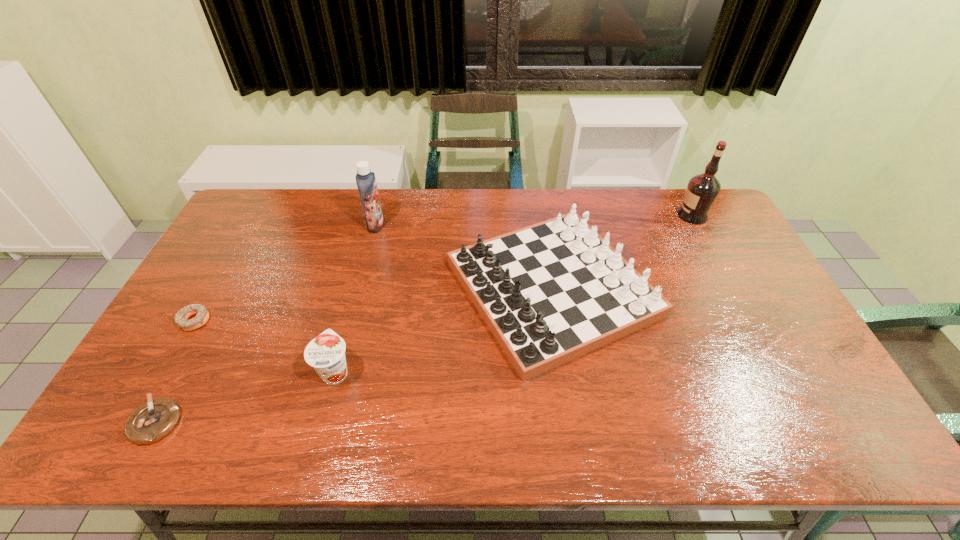
Identify the location of doughnut situated at the left edge. (202, 312).

Locate an element on the screen. Image resolution: width=960 pixels, height=540 pixels. ashtray that is positioned at the left edge is located at coordinates (156, 418).

Locate an element on the screen. This screenshot has width=960, height=540. object that is at the right edge is located at coordinates (702, 190).

Locate an element on the screen. object located at the near left corner is located at coordinates (156, 418).

Find the location of a particular element. The width and height of the screenshot is (960, 540). object located at the far right corner is located at coordinates (702, 190).

At what (x,y) coordinates should I click in order to perform the action: click on vacant point at the far edge. Please return your answer as a coordinate pair (x, y). The height and width of the screenshot is (540, 960). Looking at the image, I should click on (309, 224).

In the image, there is a desktop. Where is `vacant space at the near edge`? The height and width of the screenshot is (540, 960). vacant space at the near edge is located at coordinates (317, 435).

Where is `vacant space at the left edge of the desktop`? This screenshot has height=540, width=960. vacant space at the left edge of the desktop is located at coordinates (184, 302).

This screenshot has width=960, height=540. In order to click on vacant area at the right edge in this screenshot , I will do `click(729, 245)`.

Identify the location of free space at the far left corner. This screenshot has height=540, width=960. (270, 192).